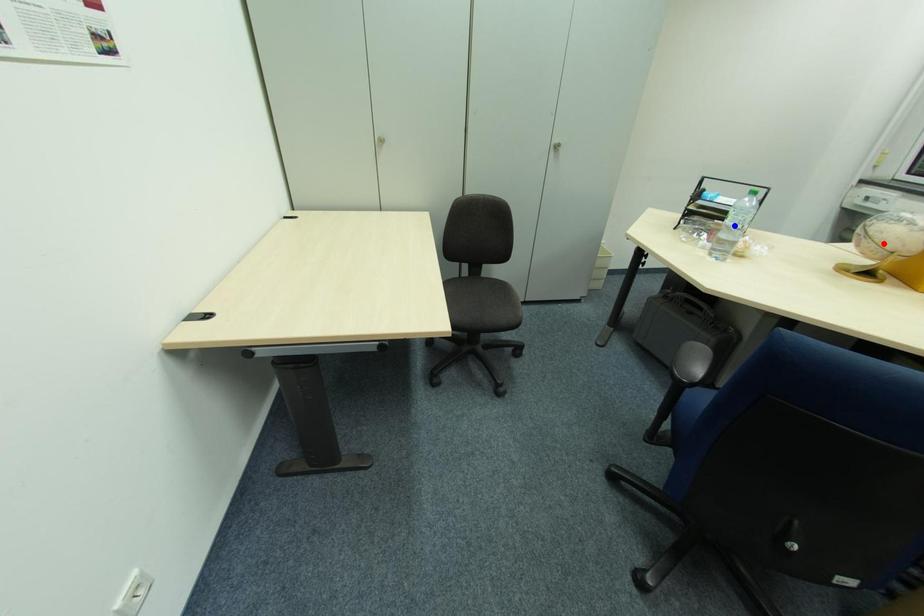
Question: Two points are marked on the image. Which point is closer to the camera?

Choices:
 (A) Blue point is closer.
 (B) Red point is closer.

Answer: (A)